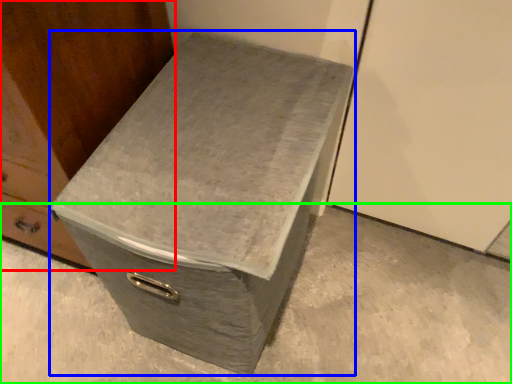
Question: Considering the real-world distances, which object is farthest from furniture (highlighted by a red box)? shoe box (highlighted by a blue box) or concrete (highlighted by a green box)?

Choices:
 (A) shoe box
 (B) concrete

Answer: (B)